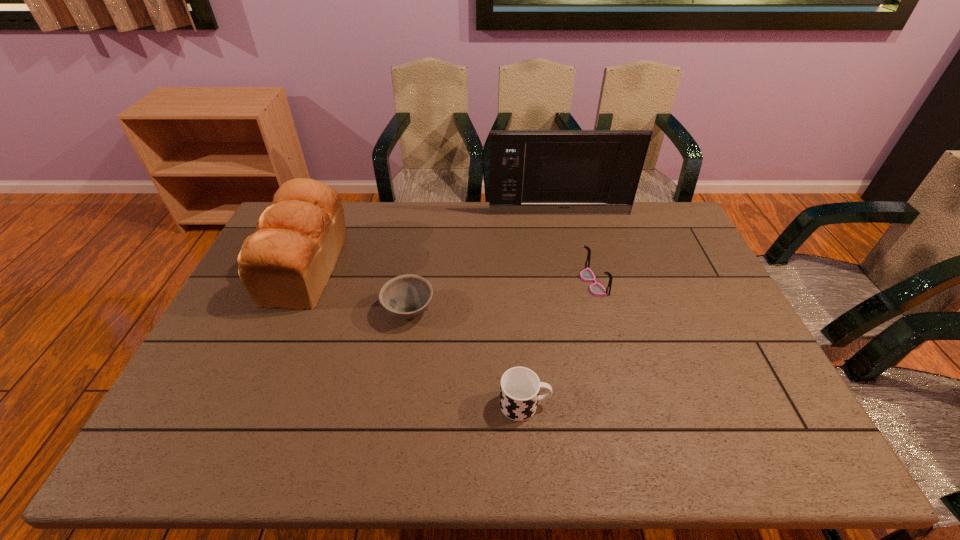
Image resolution: width=960 pixels, height=540 pixels. I want to click on free point between the bowl and the microwave oven, so click(x=484, y=262).

Locate an element on the screen. This screenshot has width=960, height=540. free space that is in between the bowl and the microwave oven is located at coordinates (484, 262).

Point out which object is positioned as the nearest to the tallest object. Please provide its 2D coordinates. Your answer should be formatted as a tuple, i.e. [(x, y)], where the tuple contains the x and y coordinates of a point satisfying the conditions above.

[(587, 275)]

Locate which object ranks third in proximity to the farthest object. Please provide its 2D coordinates. Your answer should be formatted as a tuple, i.e. [(x, y)], where the tuple contains the x and y coordinates of a point satisfying the conditions above.

[(287, 262)]